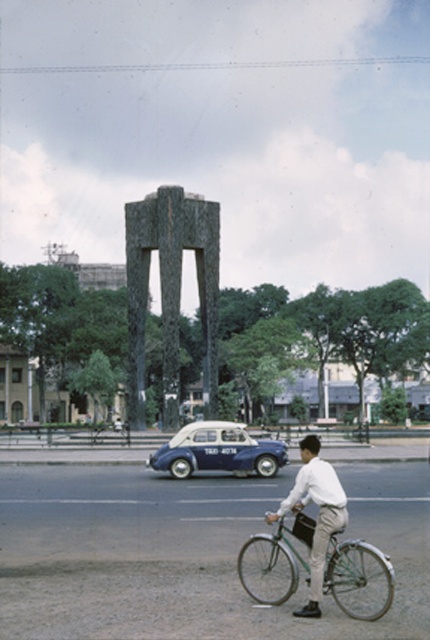
Question: From the image, what is the correct spatial relationship of green matte bicycle at center in relation to white matte taxi at center?

Choices:
 (A) right
 (B) left

Answer: (A)

Question: Which point appears closest to the camera in this image?

Choices:
 (A) (331, 541)
 (B) (315, 582)
 (C) (226, 465)

Answer: (B)

Question: Which point is closer to the camera?

Choices:
 (A) (237, 452)
 (B) (340, 547)
 (C) (310, 458)

Answer: (B)

Question: Can you confirm if green matte bicycle at center is positioned above white matte taxi at center?

Choices:
 (A) yes
 (B) no

Answer: (A)

Question: Estimate the real-world distances between objects in this image. Which object is farther from the white matte shirt at center?

Choices:
 (A) green matte bicycle at center
 (B) white matte taxi at center

Answer: (B)

Question: Does white matte taxi at center have a smaller size compared to white matte shirt at center?

Choices:
 (A) yes
 (B) no

Answer: (B)